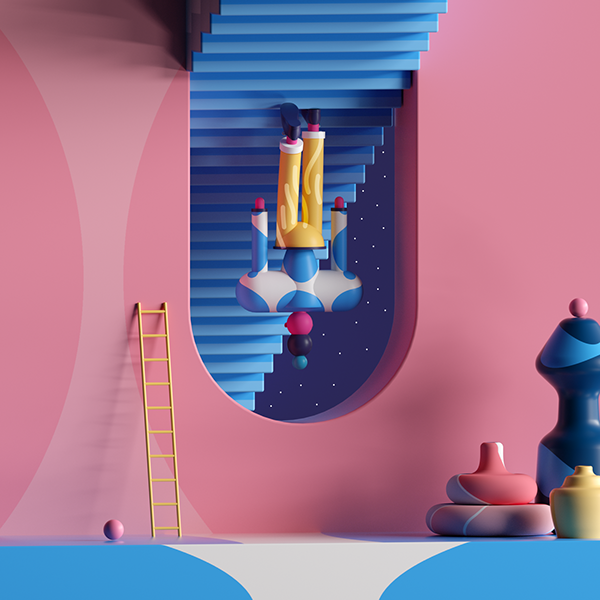
Locate an element on the screen. yellow urn is located at coordinates (582, 506).